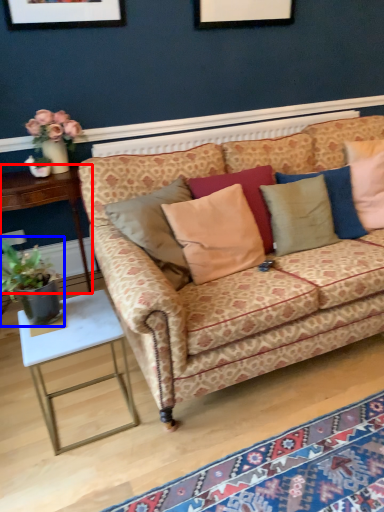
Question: Among these objects, which one is nearest to the camera, table (highlighted by a red box) or houseplant (highlighted by a blue box)?

Choices:
 (A) table
 (B) houseplant

Answer: (B)